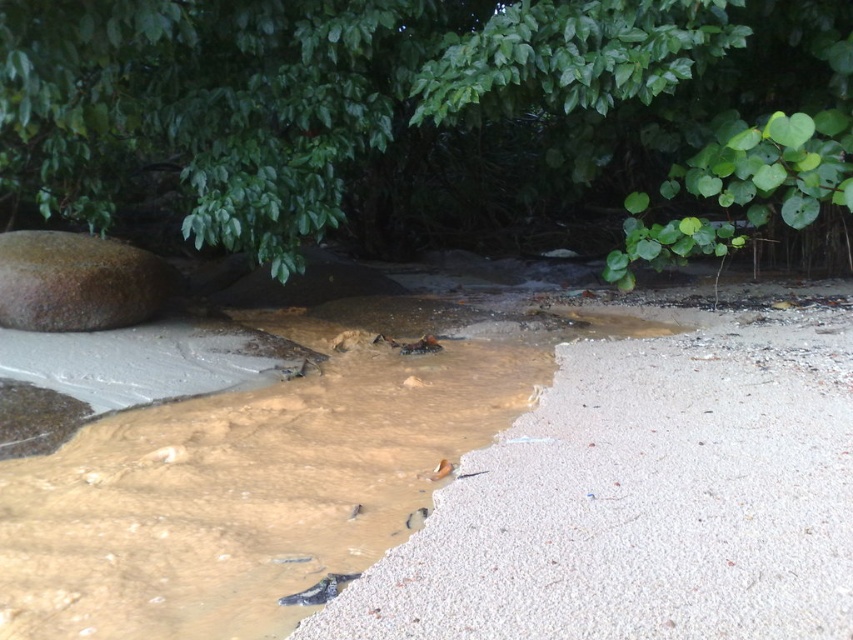
You are standing at the point marked as point (x=254, y=486) on a beach scene. The scene has brown muddy water at center and dense green foliage in the background. Which direction should you walk to reach the dense green foliage?

The point (x=254, y=486) is located on the brown muddy water at center. Since the dense green foliage is in the background, you should walk towards the background direction from the point to reach it.